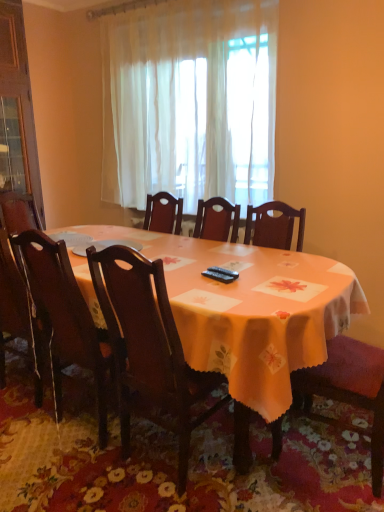
The width and height of the screenshot is (384, 512). I want to click on vacant region to the left of dark wood chair at center, placed as the 2th chair when sorted from left to right, so click(70, 478).